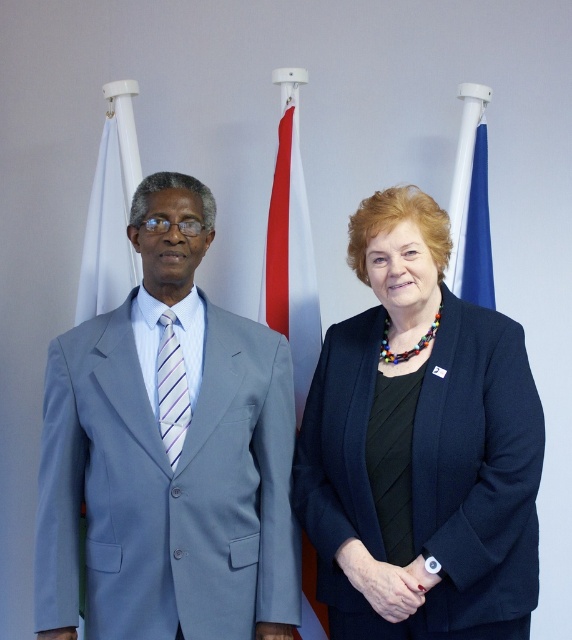
Can you confirm if white fabric flag at left is thinner than striped fabric tie at center?

In fact, white fabric flag at left might be wider than striped fabric tie at center.

Can you confirm if white fabric flag at left is positioned below striped fabric tie at center?

No.

Is point (109, 284) closer to camera compared to point (174, 461)?

No, it is not.

The image size is (572, 640). Identify the location of white fabric flag at left. (109, 221).

Can you confirm if light blue suit at left is wider than striped fabric tie at center?

Indeed, light blue suit at left has a greater width compared to striped fabric tie at center.

Can you confirm if light blue suit at left is taller than striped fabric tie at center?

Yes.

Is point (53, 589) behind point (176, 340)?

No, (53, 589) is closer to viewer.

Where is `light blue suit at left`? This screenshot has height=640, width=572. light blue suit at left is located at coordinates (166, 454).

Looking at this image, can you confirm if black fabric jacket at center is positioned above white fabric flag at left?

No, black fabric jacket at center is not above white fabric flag at left.

Who is positioned more to the right, black fabric jacket at center or white fabric flag at left?

black fabric jacket at center is more to the right.

Which is behind, point (323, 417) or point (101, 292)?

The point (101, 292) is more distant.

Find the location of a particular element. This screenshot has height=640, width=572. black fabric jacket at center is located at coordinates (419, 448).